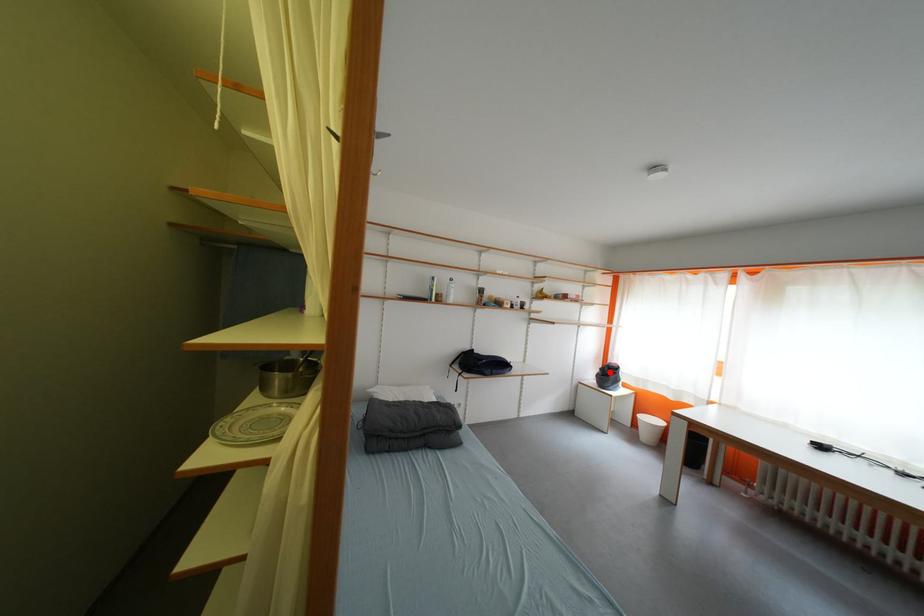
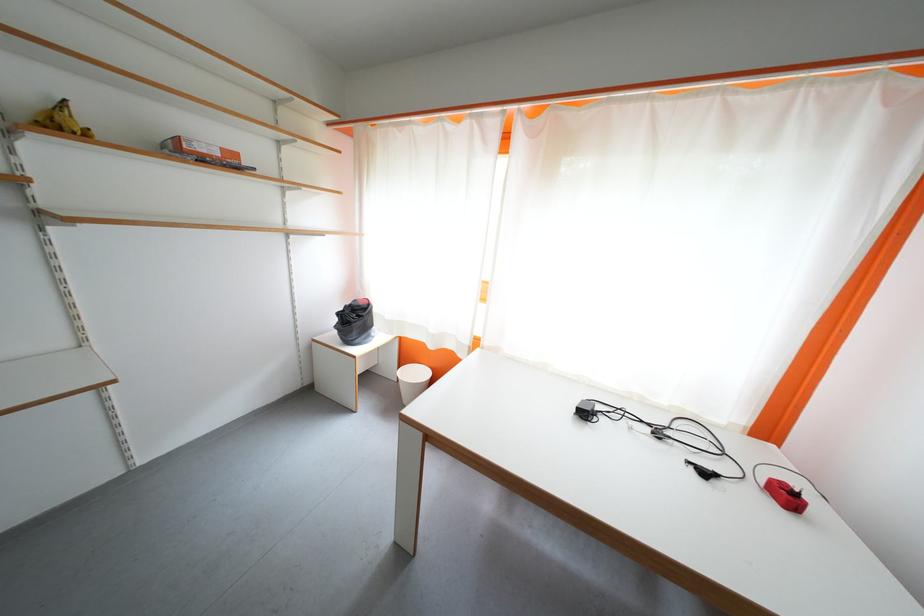
Question: I am providing you with two images of the same scene from different viewpoints. Given a red point in image1, look at the same physical point in image2. Is it:

Choices:
 (A) Closer to the viewpoint
 (B) Farther from the viewpoint

Answer: (A)